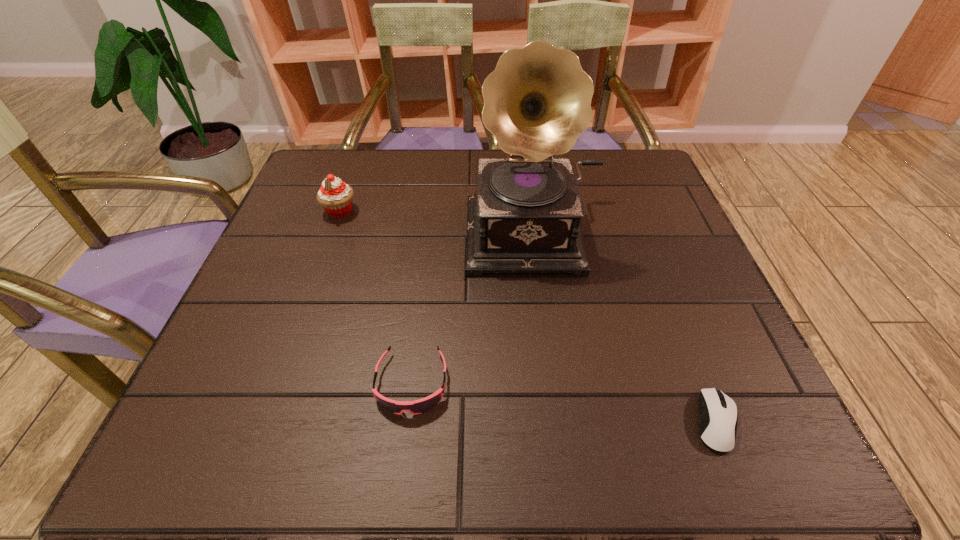
At what (x,y) coordinates should I click in order to perform the action: click on vacant region at the near left corner of the desktop. Please return your answer as a coordinate pair (x, y). Looking at the image, I should click on (173, 432).

Identify the location of vacant region at the far right corner of the desktop. (613, 198).

Image resolution: width=960 pixels, height=540 pixels. In the image, there is a desktop. In order to click on vacant space at the near right corner in this screenshot , I will do `click(756, 458)`.

Find the location of a particular element. The height and width of the screenshot is (540, 960). vacant space that's between the third object from left to right and the mouse is located at coordinates (626, 328).

At what (x,y) coordinates should I click in order to perform the action: click on vacant area that lies between the shortest object and the cupcake. Please return your answer as a coordinate pair (x, y). Looking at the image, I should click on (528, 317).

Identify the location of vacant space in between the third object from right to left and the mouse. (564, 403).

Identify the location of free area in between the tallest object and the goggles. The image size is (960, 540). (474, 308).

Locate an element on the screen. The width and height of the screenshot is (960, 540). unoccupied position between the third shortest object and the shortest object is located at coordinates (528, 317).

The width and height of the screenshot is (960, 540). In order to click on free area in between the tallest object and the mouse in this screenshot , I will do `click(626, 328)`.

I want to click on vacant area that lies between the record player and the rightmost object, so click(626, 328).